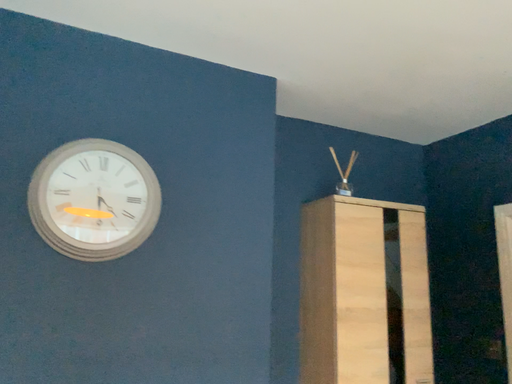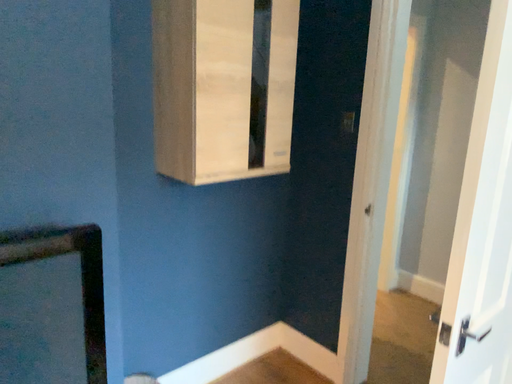
Question: How did the camera likely rotate when shooting the video?

Choices:
 (A) rotated downward
 (B) rotated upward

Answer: (A)